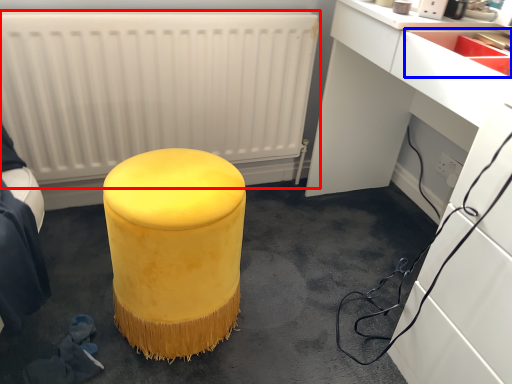
Question: Among these objects, which one is nearest to the camera, radiator (highlighted by a red box) or sink (highlighted by a blue box)?

Choices:
 (A) radiator
 (B) sink

Answer: (B)